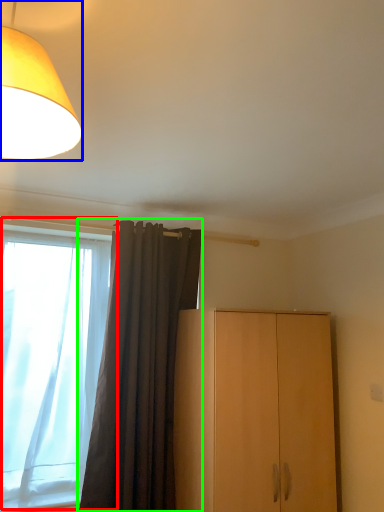
Question: Based on their relative distances, which object is nearer to window (highlighted by a red box)? Choose from lamp (highlighted by a blue box) and curtain (highlighted by a green box).

Choices:
 (A) lamp
 (B) curtain

Answer: (B)